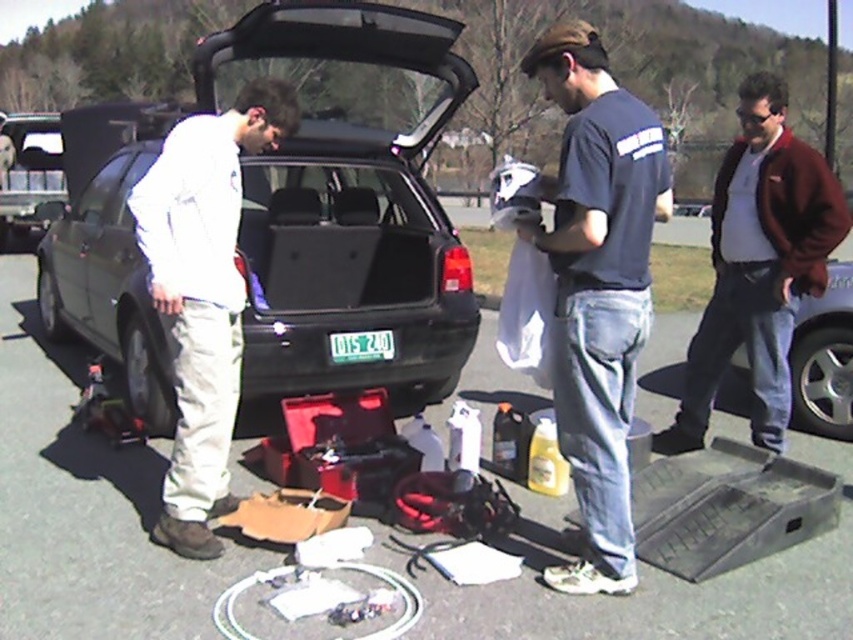
You are a delivery robot with a width of 1.2 meters. You need to move from the left side of the matte black car at center to the right side of the metallic silver car at right. Is there enough space between them for you to pass through?

The distance between the matte black car at center and the metallic silver car at right is 2.82 meters. Since the robot is 1.2 meters wide, there is sufficient space to pass through as 2.82 meters is greater than 1.2 meters.

You are a delivery person who needs to choose between the matte black car at center and the metallic silver car at right for transporting a large appliance. Which car would you choose and why?

The matte black car at center has a larger size compared to the metallic silver car at right, so it would be more suitable for transporting a large appliance due to its bigger space capacity.